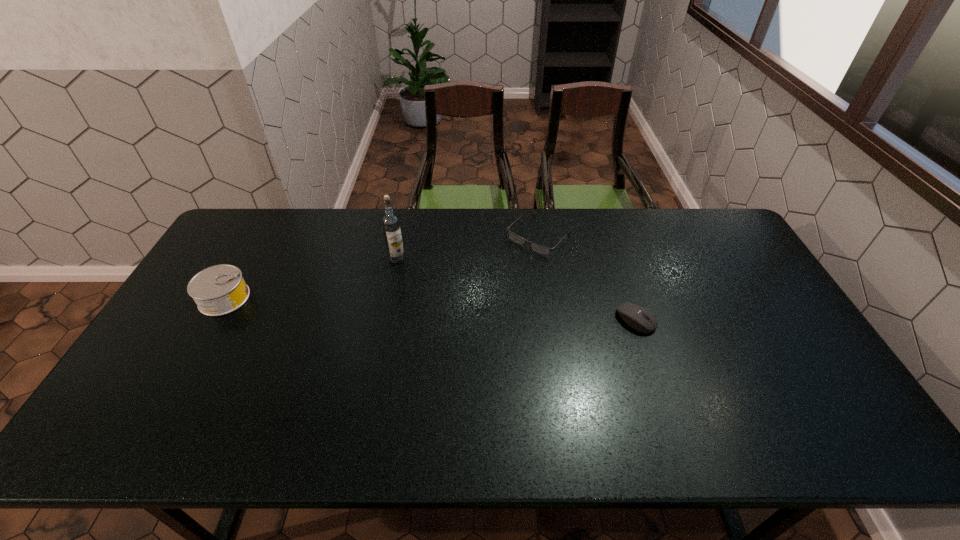
You are a GUI agent. You are given a task and a screenshot of the screen. Output one action in this format:
    pyautogui.click(x=<x>, y=<y>)
    Task: Click on the vacant space on the desktop that is between the second tallest object and the rightmost object and is positioned on the label of the tallest object
    The image size is (960, 540).
    Given the screenshot: What is the action you would take?
    pyautogui.click(x=368, y=306)

You are a GUI agent. You are given a task and a screenshot of the screen. Output one action in this format:
    pyautogui.click(x=<x>, y=<y>)
    Task: Click on the vacant spot on the desktop that is between the leftmost object and the computer equipment and is positioned on the front-facing side of the third object from left to right
    The image size is (960, 540).
    Given the screenshot: What is the action you would take?
    pyautogui.click(x=465, y=310)